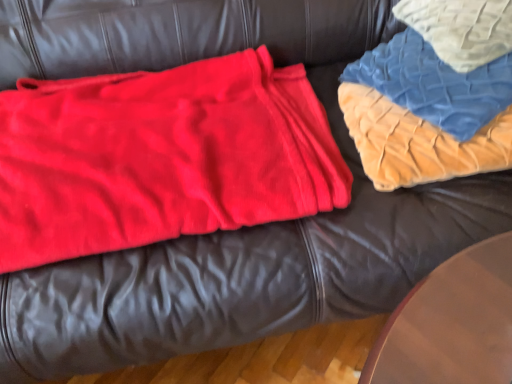
Question: From a real-world perspective, is blue quilted fabric at upper right physically above velvet quilt at upper right?

Choices:
 (A) no
 (B) yes

Answer: (B)

Question: Is velvet quilt at upper right a part of blue quilted fabric at upper right?

Choices:
 (A) no
 (B) yes

Answer: (B)

Question: Does blue quilted fabric at upper right appear on the right side of velvet quilt at upper right?

Choices:
 (A) no
 (B) yes

Answer: (B)

Question: Considering the relative sizes of blue quilted fabric at upper right and velvet quilt at upper right in the image provided, is blue quilted fabric at upper right bigger than velvet quilt at upper right?

Choices:
 (A) no
 (B) yes

Answer: (A)

Question: Does blue quilted fabric at upper right have a greater height compared to velvet quilt at upper right?

Choices:
 (A) yes
 (B) no

Answer: (B)

Question: Looking at their shapes, would you say matte red blanket at left is wider or thinner than blue quilted fabric at upper right?

Choices:
 (A) thin
 (B) wide

Answer: (B)

Question: Is matte red blanket at left in front of or behind blue quilted fabric at upper right in the image?

Choices:
 (A) behind
 (B) front

Answer: (B)

Question: In terms of height, does matte red blanket at left look taller or shorter compared to blue quilted fabric at upper right?

Choices:
 (A) short
 (B) tall

Answer: (A)

Question: Looking at the image, does matte red blanket at left seem bigger or smaller compared to blue quilted fabric at upper right?

Choices:
 (A) small
 (B) big

Answer: (B)

Question: Which is correct: blue quilted fabric at upper right is inside matte red blanket at left, or outside of it?

Choices:
 (A) inside
 (B) outside

Answer: (B)

Question: In the image, is blue quilted fabric at upper right positioned in front of or behind matte red blanket at left?

Choices:
 (A) front
 (B) behind

Answer: (B)

Question: Is point (430, 29) positioned closer to the camera than point (2, 188)?

Choices:
 (A) closer
 (B) farther

Answer: (B)

Question: Is blue quilted fabric at upper right bigger or smaller than matte red blanket at left?

Choices:
 (A) small
 (B) big

Answer: (A)

Question: Looking at their shapes, would you say blue quilted fabric at upper right is wider or thinner than velvet quilt at upper right?

Choices:
 (A) wide
 (B) thin

Answer: (A)

Question: Based on their positions, is blue quilted fabric at upper right located to the left or right of velvet quilt at upper right?

Choices:
 (A) right
 (B) left

Answer: (A)